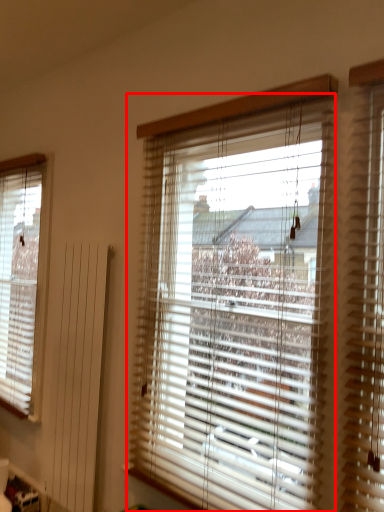
Question: Considering the relative positions of window blind (annotated by the red box) and window blind in the image provided, where is window blind (annotated by the red box) located with respect to the staircase?

Choices:
 (A) left
 (B) right

Answer: (B)